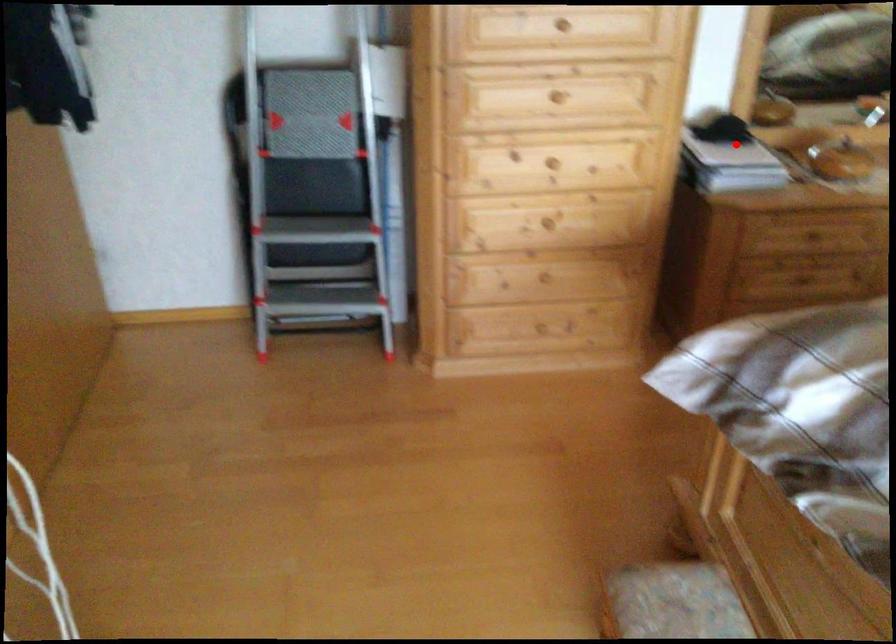
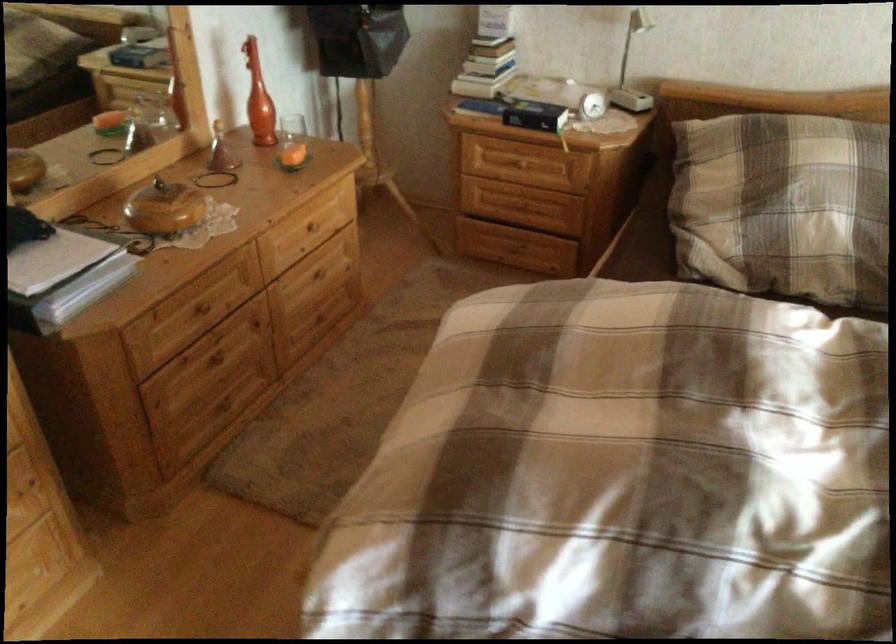
Question: I am providing you with two images of the same scene from different viewpoints. Given a red point in image1, look at the same physical point in image2. Is it:

Choices:
 (A) Closer to the viewpoint
 (B) Farther from the viewpoint

Answer: (A)